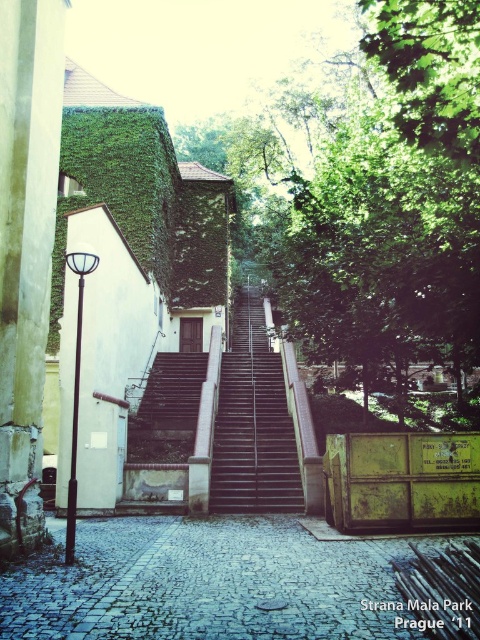
Question: Is cobblestone alley at center positioned behind dark gray concrete stairs at center?

Choices:
 (A) yes
 (B) no

Answer: (B)

Question: Can you confirm if green leafy tree at center is smaller than black metal stairs at center?

Choices:
 (A) no
 (B) yes

Answer: (A)

Question: Among these points, which one is farthest from the camera?

Choices:
 (A) (220, 634)
 (B) (184, 416)
 (C) (223, 460)
 (D) (356, 339)

Answer: (B)

Question: Does black metal stairs at center come behind dark gray concrete stairs at center?

Choices:
 (A) no
 (B) yes

Answer: (A)

Question: Based on their relative distances, which object is nearer to the green leafy tree at center?

Choices:
 (A) cobblestone alley at center
 (B) dark gray concrete stairs at center
 (C) black metal stairs at center

Answer: (C)

Question: Which object is positioned closest to the dark gray concrete stairs at center?

Choices:
 (A) cobblestone alley at center
 (B) green leafy tree at center
 (C) black metal stairs at center

Answer: (C)